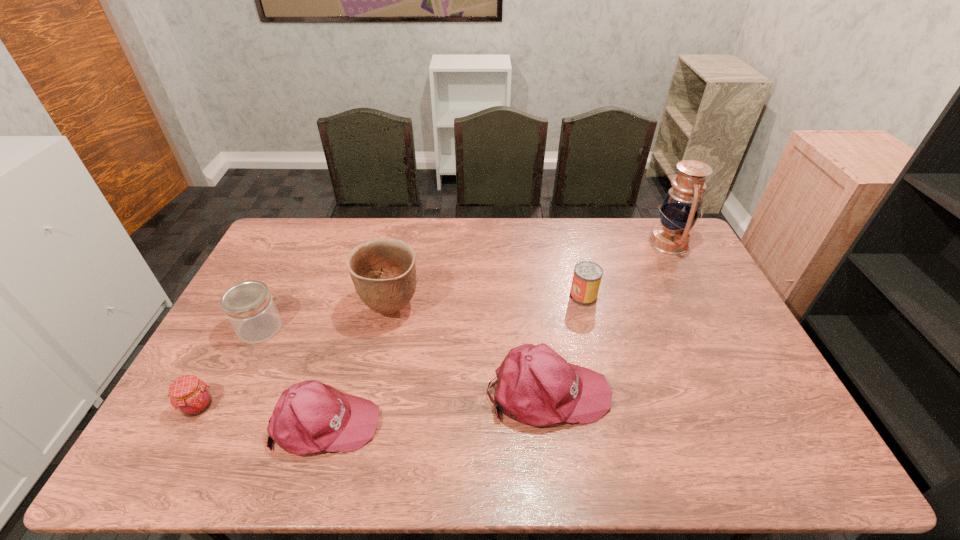
Image resolution: width=960 pixels, height=540 pixels. I want to click on the left baseball cap, so click(x=310, y=417).

The width and height of the screenshot is (960, 540). In order to click on the right baseball cap in this screenshot , I will do `click(535, 385)`.

This screenshot has height=540, width=960. Find the location of `the rightmost object`. the rightmost object is located at coordinates (681, 207).

The image size is (960, 540). I want to click on the farthest object, so click(x=681, y=207).

Find the location of `can`. can is located at coordinates (587, 276).

In order to click on jar in this screenshot , I will do `click(249, 307)`.

At what (x,y) coordinates should I click in order to perform the action: click on the second tallest object. Please return your answer as a coordinate pair (x, y). This screenshot has width=960, height=540. Looking at the image, I should click on (383, 271).

Locate an element on the screen. This screenshot has height=540, width=960. the shortest object is located at coordinates (189, 395).

The image size is (960, 540). I want to click on free space located 0.270m at the front of the shorter baseball cap with the brim, so click(487, 423).

At what (x,y) coordinates should I click in order to perform the action: click on free region located 0.170m at the front of the taller baseball cap with the brim. Please return your answer as a coordinate pair (x, y). The height and width of the screenshot is (540, 960). Looking at the image, I should click on (673, 392).